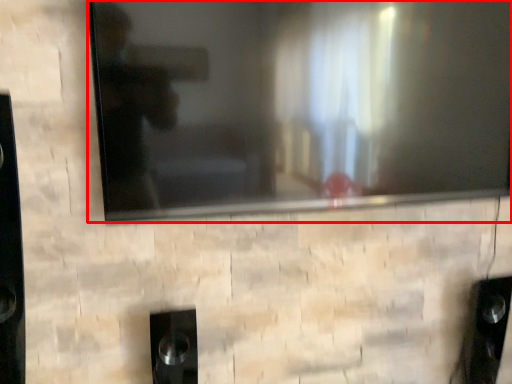
Question: From the image's perspective, what is the correct spatial relationship of television (annotated by the red box) in relation to speaker?

Choices:
 (A) below
 (B) above

Answer: (B)